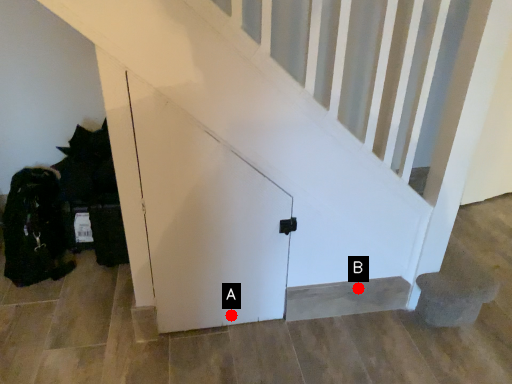
Question: Two points are circled on the image, labeled by A and B beside each circle. Among these points, which one is nearest to the camera?

Choices:
 (A) A is closer
 (B) B is closer

Answer: (A)